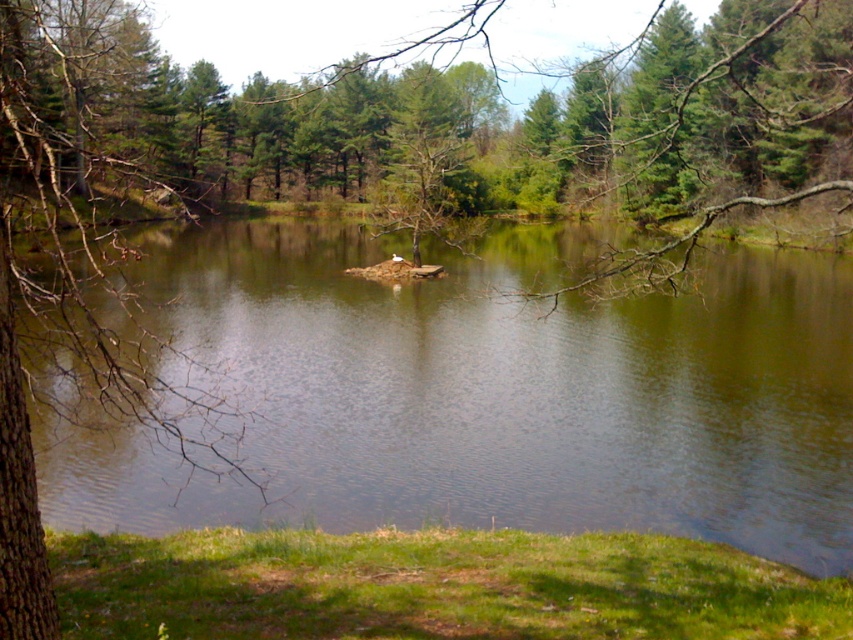
Consider the image. Is green reflective water at center to the left of brown bark tree at left from the viewer's perspective?

Incorrect, green reflective water at center is not on the left side of brown bark tree at left.

Is point (148, 237) positioned after point (45, 316)?

That is True.

Where is `green reflective water at center`? The width and height of the screenshot is (853, 640). green reflective water at center is located at coordinates (490, 394).